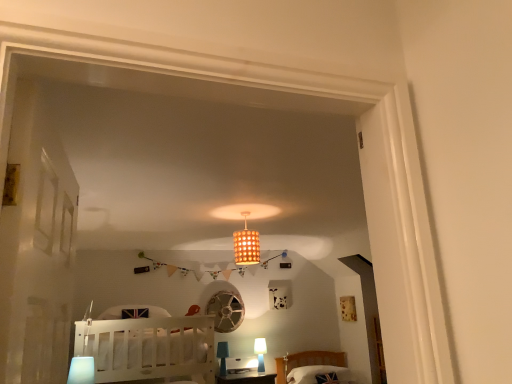
Question: Is wooden textured lampshade at center, arranged as the fourth lamp when ordered from the bottom, spatially inside matte white lamp at lower center, placed as the 4th lamp when sorted from front to back, or outside of it?

Choices:
 (A) inside
 (B) outside

Answer: (B)

Question: Is wooden textured lampshade at center, which is the first lamp in top-to-bottom order, to the left or to the right of matte white lamp at lower center, placed as the 1th lamp when sorted from back to front, in the image?

Choices:
 (A) right
 (B) left

Answer: (B)

Question: Estimate the real-world distances between objects in this image. Which object is closer to the white wood crib at lower left?

Choices:
 (A) white fabric pillow at lower right
 (B) wooden textured lampshade at center, which appears as the second lamp when viewed from the right
 (C) matte white lamp at lower center, marked as the fourth lamp in a left-to-right arrangement
 (D) blue frosted glass lamp at lower left, acting as the 1th lamp starting from the front
 (E) blue glass lamp at lower center, marked as the 2th lamp in a back-to-front arrangement

Answer: (D)

Question: Estimate the real-world distances between objects in this image. Which object is farther from the white wood crib at lower left?

Choices:
 (A) blue frosted glass lamp at lower left, which ranks as the fourth lamp in back-to-front order
 (B) matte white lamp at lower center, marked as the fourth lamp in a left-to-right arrangement
 (C) wooden textured lampshade at center, the 3th lamp viewed from the left
 (D) white fabric pillow at lower right
 (E) blue glass lamp at lower center, arranged as the 3th lamp when viewed from the right

Answer: (D)